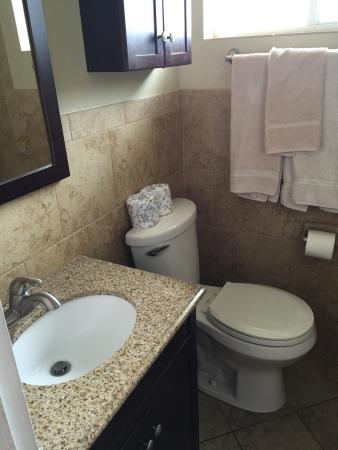
I want to click on towels, so click(x=274, y=120), click(x=258, y=161), click(x=313, y=170).